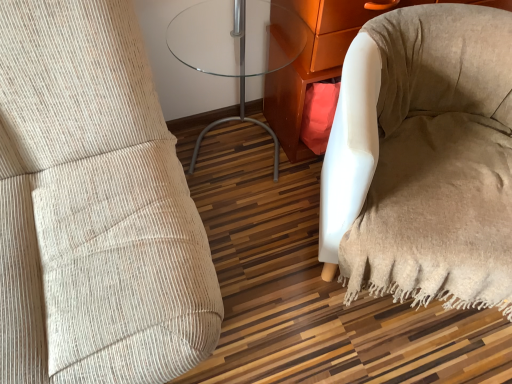
The height and width of the screenshot is (384, 512). What do you see at coordinates (311, 63) in the screenshot?
I see `white fabric armchair at lower right` at bounding box center [311, 63].

You are a GUI agent. You are given a task and a screenshot of the screen. Output one action in this format:
    pyautogui.click(x=<x>, y=<y>)
    Task: Click on the transparent glass table at center
    The width and height of the screenshot is (512, 384).
    Given the screenshot: What is the action you would take?
    pyautogui.click(x=236, y=46)

Is transparent glass table at center taller or shorter than beige fabric bean bag chair at lower right?

Clearly, transparent glass table at center is taller compared to beige fabric bean bag chair at lower right.

From the image's perspective, is transparent glass table at center above beige fabric bean bag chair at lower right?

Indeed, from the image's perspective, transparent glass table at center is shown above beige fabric bean bag chair at lower right.

What's the angular difference between transparent glass table at center and beige fabric bean bag chair at lower right's facing directions?

25.9 degrees separate the facing orientations of transparent glass table at center and beige fabric bean bag chair at lower right.

From their relative heights in the image, would you say beige fabric bean bag chair at lower right is taller or shorter than transparent glass table at center?

In the image, beige fabric bean bag chair at lower right appears to be shorter than transparent glass table at center.

Which is behind, beige fabric bean bag chair at lower right or transparent glass table at center?

Positioned behind is transparent glass table at center.

Would you say beige fabric bean bag chair at lower right is inside or outside transparent glass table at center?

beige fabric bean bag chair at lower right is not inside transparent glass table at center, it's outside.

Locate an element on the screen. furniture above the beige fabric bean bag chair at lower right (from a real-world perspective) is located at coordinates (311, 63).

Considering the sizes of objects beige fabric bean bag chair at lower right and white fabric armchair at lower right in the image provided, who is smaller, beige fabric bean bag chair at lower right or white fabric armchair at lower right?

With smaller size is white fabric armchair at lower right.

Considering the points (426, 98) and (300, 143), which point is in front, point (426, 98) or point (300, 143)?

Positioned in front is point (426, 98).

Is transparent glass table at center bigger than white fabric armchair at lower right?

Incorrect, transparent glass table at center is not larger than white fabric armchair at lower right.

From their relative heights in the image, would you say transparent glass table at center is taller or shorter than white fabric armchair at lower right?

Clearly, transparent glass table at center is taller compared to white fabric armchair at lower right.

Looking at this image, would you say transparent glass table at center contains white fabric armchair at lower right?

That's incorrect, white fabric armchair at lower right is not inside transparent glass table at center.

In the scene shown: From the image's perspective, is transparent glass table at center beneath white fabric armchair at lower right?

Yes, from the image's perspective, transparent glass table at center is beneath white fabric armchair at lower right.

Which is more to the left, white fabric armchair at lower right or transparent glass table at center?

From the viewer's perspective, transparent glass table at center appears more on the left side.

Considering the sizes of white fabric armchair at lower right and transparent glass table at center in the image, is white fabric armchair at lower right bigger or smaller than transparent glass table at center?

In the image, white fabric armchair at lower right appears to be larger than transparent glass table at center.

Identify the location of table in front of the white fabric armchair at lower right. (236, 46).

You are a GUI agent. You are given a task and a screenshot of the screen. Output one action in this format:
    pyautogui.click(x=<x>, y=<y>)
    Task: Click on the bean bag chair below the white fabric armchair at lower right (from the image's perspective)
    The image size is (512, 384).
    Given the screenshot: What is the action you would take?
    pyautogui.click(x=424, y=159)

From a real-world perspective, is white fabric armchair at lower right above or below beige fabric bean bag chair at lower right?

white fabric armchair at lower right is situated higher than beige fabric bean bag chair at lower right in the real world.

Does white fabric armchair at lower right have a greater height compared to beige fabric bean bag chair at lower right?

Yes.

Is white fabric armchair at lower right to the left of beige fabric bean bag chair at lower right from the viewer's perspective?

Indeed, white fabric armchair at lower right is positioned on the left side of beige fabric bean bag chair at lower right.

I want to click on table above the beige fabric bean bag chair at lower right (from the image's perspective), so click(236, 46).

Image resolution: width=512 pixels, height=384 pixels. What are the coordinates of `bean bag chair on the right of transparent glass table at center` in the screenshot? It's located at (424, 159).

Considering their positions, is beige fabric bean bag chair at lower right positioned further to white fabric armchair at lower right than transparent glass table at center?

Among the two, beige fabric bean bag chair at lower right is located further to white fabric armchair at lower right.

Based on their spatial positions, is transparent glass table at center or beige fabric bean bag chair at lower right further from white fabric armchair at lower right?

beige fabric bean bag chair at lower right is positioned further to the anchor white fabric armchair at lower right.

From the image, which object appears to be nearer to beige fabric bean bag chair at lower right, white fabric armchair at lower right or transparent glass table at center?

Among the two, white fabric armchair at lower right is located nearer to beige fabric bean bag chair at lower right.

Which object lies nearer to the anchor point transparent glass table at center, white fabric armchair at lower right or beige fabric bean bag chair at lower right?

white fabric armchair at lower right is positioned closer to the anchor transparent glass table at center.

Looking at the image, which one is located closer to transparent glass table at center, beige fabric bean bag chair at lower right or white fabric armchair at lower right?

white fabric armchair at lower right is positioned closer to the anchor transparent glass table at center.

Considering their positions, is transparent glass table at center positioned closer to beige fabric bean bag chair at lower right than white fabric armchair at lower right?

white fabric armchair at lower right is closer to beige fabric bean bag chair at lower right.

This screenshot has width=512, height=384. What are the coordinates of `furniture located between transparent glass table at center and beige fabric bean bag chair at lower right in the left-right direction` in the screenshot? It's located at (311, 63).